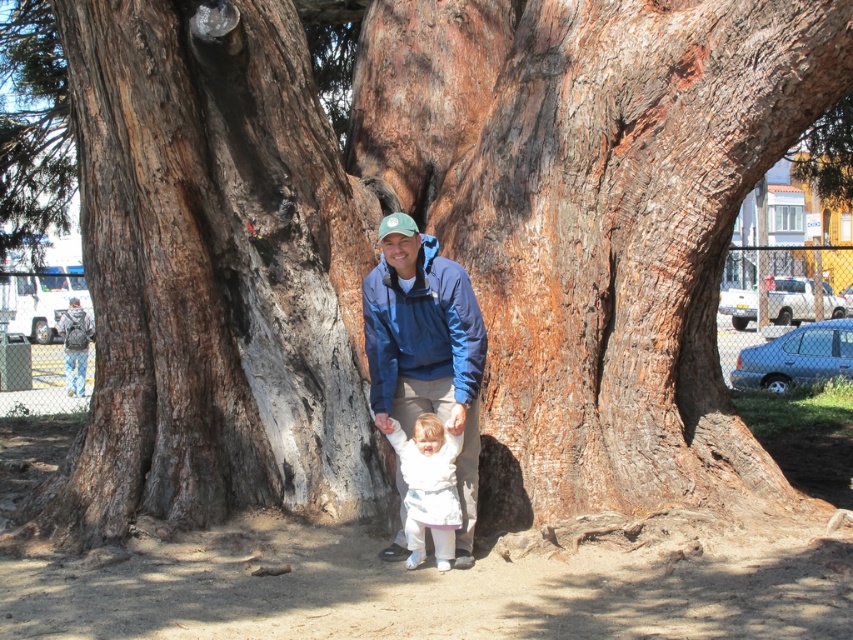
Question: Which object is farther from the camera taking this photo?

Choices:
 (A) white soft baby at center
 (B) dark brown rough bark at center

Answer: (B)

Question: Considering the relative positions of dark brown rough bark at center and white soft baby at center in the image provided, where is dark brown rough bark at center located with respect to white soft baby at center?

Choices:
 (A) left
 (B) right

Answer: (A)

Question: Is dark brown rough bark at center to the right of blue fabric jacket at center from the viewer's perspective?

Choices:
 (A) no
 (B) yes

Answer: (A)

Question: Which of these objects is positioned closest to the dark brown rough bark at center?

Choices:
 (A) white soft baby at center
 (B) blue fabric jacket at center

Answer: (B)

Question: From the image, what is the correct spatial relationship of dark brown rough bark at center in relation to blue fabric jacket at center?

Choices:
 (A) above
 (B) below

Answer: (A)

Question: Which point is closer to the camera taking this photo?

Choices:
 (A) (448, 554)
 (B) (431, 344)

Answer: (A)